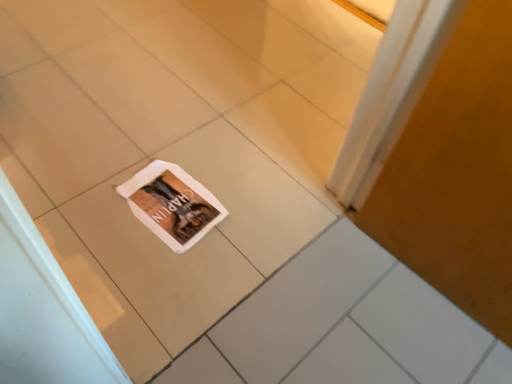
This screenshot has height=384, width=512. What do you see at coordinates (172, 204) in the screenshot?
I see `white paper postcard at center` at bounding box center [172, 204].

What is the approximate height of white paper postcard at center?

It is 0.59 inches.

Where is `white paper postcard at center`? white paper postcard at center is located at coordinates (172, 204).

At what (x,y) coordinates should I click in order to perform the action: click on white paper postcard at center. Please return your answer as a coordinate pair (x, y). This screenshot has width=512, height=384. Looking at the image, I should click on coord(172,204).